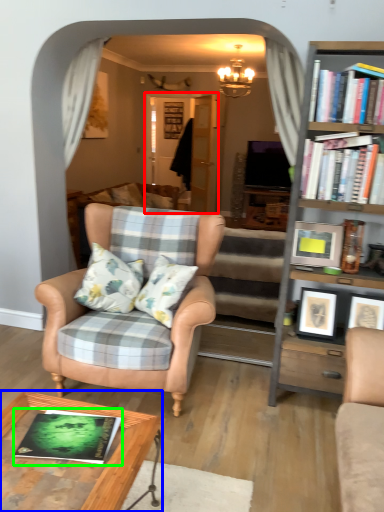
Question: Which object is positioned farthest from glass door (highlighted by a red box)? Select from table (highlighted by a blue box) and book (highlighted by a green box).

Choices:
 (A) table
 (B) book

Answer: (B)